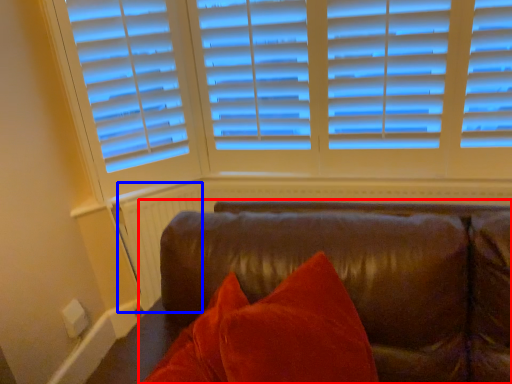
Question: Among these objects, which one is nearest to the camera, studio couch (highlighted by a red box) or radiator (highlighted by a blue box)?

Choices:
 (A) studio couch
 (B) radiator

Answer: (A)